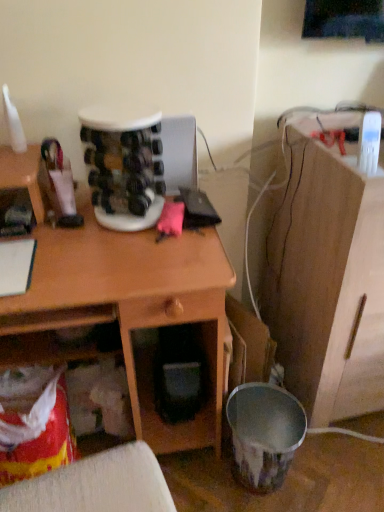
What is the approximate width of wooden desk at center?

21.05 inches.

What is the approximate height of wooden desk at center?

The height of wooden desk at center is 90.95 centimeters.

What do you see at coordinates (125, 309) in the screenshot?
I see `wooden desk at center` at bounding box center [125, 309].

This screenshot has width=384, height=512. Find the location of `wooden desk at center`. wooden desk at center is located at coordinates (125, 309).

The image size is (384, 512). Describe the element at coordinates (327, 280) in the screenshot. I see `wooden cabinet at right` at that location.

Locate an element on the screen. This screenshot has height=512, width=384. wooden cabinet at right is located at coordinates (327, 280).

In order to face wooden cabinet at right, should I rotate leftwards or rightwards?

A 23.848 degree turn to the right will do.

Image resolution: width=384 pixels, height=512 pixels. Identify the location of wooden desk at center. coord(125,309).

Is wooden desk at center at the left side of wooden cabinet at right?

Yes.

Based on the photo, between wooden desk at center and wooden cabinet at right, which one is positioned behind?

wooden cabinet at right is further from the camera.

Does point (99, 258) appear closer or farther from the camera than point (369, 366)?

Point (99, 258) is closer to the camera than point (369, 366).

From the image's perspective, between wooden desk at center and wooden cabinet at right, who is located below?

wooden desk at center.

From a real-world perspective, which object rests below the other?

From a 3D spatial view, wooden desk at center is below.

Considering the relative sizes of wooden desk at center and wooden cabinet at right in the image provided, is wooden desk at center thinner than wooden cabinet at right?

Yes.

From their relative heights in the image, would you say wooden desk at center is taller or shorter than wooden cabinet at right?

In the image, wooden desk at center appears to be shorter than wooden cabinet at right.

Looking at the image, does wooden desk at center seem bigger or smaller compared to wooden cabinet at right?

Considering their sizes, wooden desk at center takes up more space than wooden cabinet at right.

Would you say wooden desk at center contains wooden cabinet at right?

Actually, wooden cabinet at right is outside wooden desk at center.

Is wooden desk at center directly adjacent to wooden cabinet at right?

There is a gap between wooden desk at center and wooden cabinet at right.

Is wooden desk at center facing away from wooden cabinet at right?

wooden desk at center does not have its back to wooden cabinet at right.

What's the angular difference between wooden desk at center and wooden cabinet at right's facing directions?

The facing directions of wooden desk at center and wooden cabinet at right are 1.69 degrees apart.

Where is `computer desk located on the right of wooden desk at center`? computer desk located on the right of wooden desk at center is located at coordinates (327, 280).

Considering the relative positions of wooden cabinet at right and wooden desk at center in the image provided, is wooden cabinet at right to the right of wooden desk at center from the viewer's perspective?

Correct, you'll find wooden cabinet at right to the right of wooden desk at center.

Does wooden cabinet at right come in front of wooden desk at center?

That is False.

Is point (368, 387) in front of point (78, 358)?

No, it is not.

From the image's perspective, which one is positioned lower, wooden cabinet at right or wooden desk at center?

From the image's view, wooden desk at center is below.

From a real-world perspective, is wooden cabinet at right under wooden desk at center?

Actually, wooden cabinet at right is physically above wooden desk at center in the real world.

Which object is wider, wooden cabinet at right or wooden desk at center?

Wider between the two is wooden cabinet at right.

Between wooden cabinet at right and wooden desk at center, which one has less height?

With less height is wooden desk at center.

Which of these two, wooden cabinet at right or wooden desk at center, is smaller?

wooden cabinet at right.

Can we say wooden cabinet at right lies outside wooden desk at center?

That's correct, wooden cabinet at right is outside of wooden desk at center.

Is wooden cabinet at right touching wooden desk at center?

No.

Is wooden cabinet at right oriented towards wooden desk at center?

No, wooden cabinet at right is not oriented towards wooden desk at center.

How different are the orientations of wooden cabinet at right and wooden desk at center in degrees?

The facing directions of wooden cabinet at right and wooden desk at center are 1.69 degrees apart.

In order to click on computer desk above the wooden desk at center (from a real-world perspective) in this screenshot , I will do `click(327, 280)`.

Identify the location of computer desk located above the wooden desk at center (from a real-world perspective). This screenshot has height=512, width=384. (327, 280).

I want to click on computer desk that appears behind the wooden desk at center, so click(x=327, y=280).